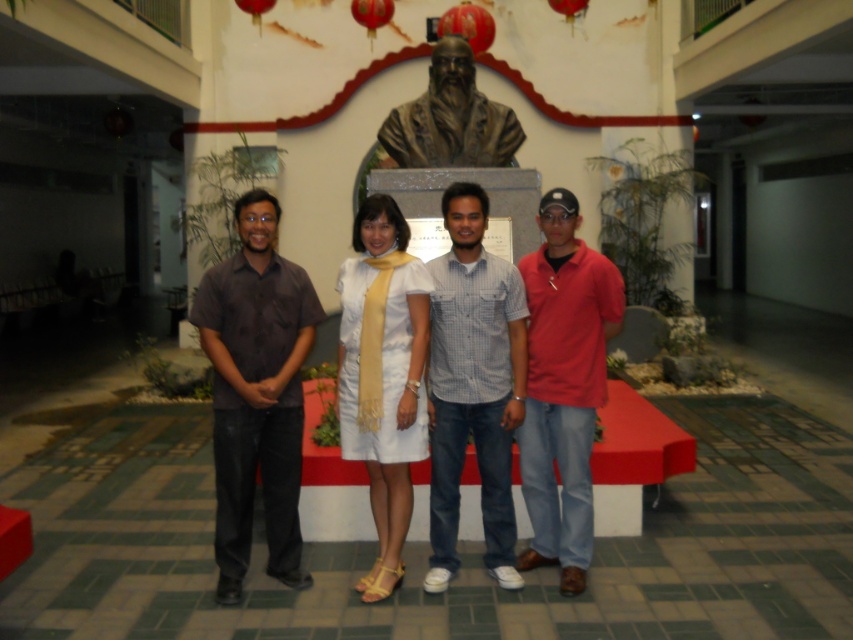
Between point (287, 372) and point (543, 371), which one is positioned in front?

Point (287, 372) is more forward.

Can you confirm if dark gray shirt at left is thinner than red cotton polo shirt at right?

Incorrect, dark gray shirt at left's width is not less than red cotton polo shirt at right's.

Describe the element at coordinates (256, 392) in the screenshot. This screenshot has height=640, width=853. I see `dark gray shirt at left` at that location.

The width and height of the screenshot is (853, 640). Identify the location of dark gray shirt at left. (256, 392).

Does red cotton polo shirt at right appear over bronze bust at center?

No.

Can you confirm if red cotton polo shirt at right is positioned to the right of bronze bust at center?

Yes, red cotton polo shirt at right is to the right of bronze bust at center.

Which is in front, point (567, 570) or point (492, 132)?

Positioned in front is point (567, 570).

I want to click on red cotton polo shirt at right, so 563,385.

Consider the image. Can you confirm if dark gray shirt at left is shorter than checkered fabric shirt at center?

Yes.

Between dark gray shirt at left and checkered fabric shirt at center, which one appears on the left side from the viewer's perspective?

From the viewer's perspective, dark gray shirt at left appears more on the left side.

The width and height of the screenshot is (853, 640). Find the location of `dark gray shirt at left`. dark gray shirt at left is located at coordinates (256, 392).